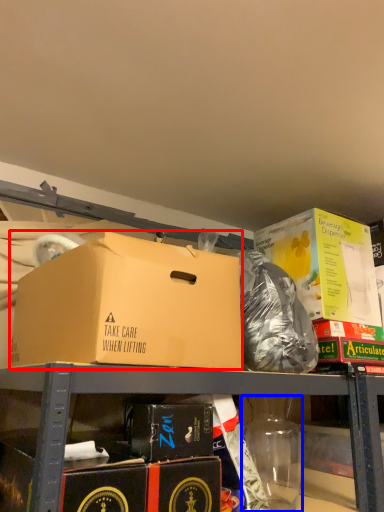
Question: Which object is closer to the camera taking this photo, box (highlighted by a red box) or bottle (highlighted by a blue box)?

Choices:
 (A) box
 (B) bottle

Answer: (A)